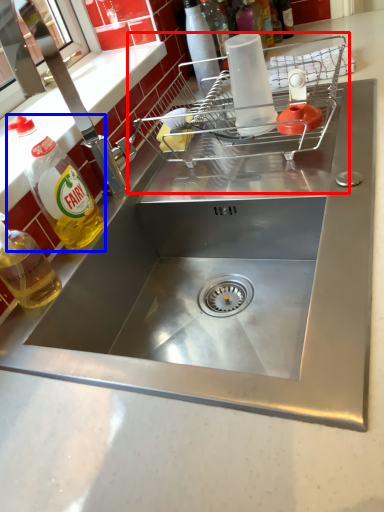
Question: Which object is further to the camera taking this photo, appliance (highlighted by a red box) or bottle (highlighted by a blue box)?

Choices:
 (A) appliance
 (B) bottle

Answer: (A)